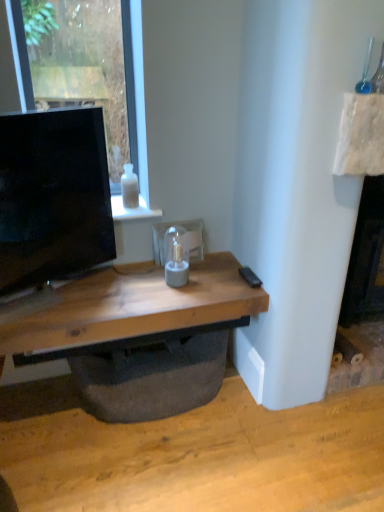
Question: Could you tell me if black plastic remote at lower right is turned towards wooden desk at center?

Choices:
 (A) no
 (B) yes

Answer: (B)

Question: Is black plastic remote at lower right to the left of wooden desk at center from the viewer's perspective?

Choices:
 (A) yes
 (B) no

Answer: (B)

Question: Does black plastic remote at lower right have a smaller size compared to wooden desk at center?

Choices:
 (A) no
 (B) yes

Answer: (B)

Question: From a real-world perspective, is black plastic remote at lower right physically above wooden desk at center?

Choices:
 (A) yes
 (B) no

Answer: (A)

Question: Is wooden desk at center completely or partially inside black plastic remote at lower right?

Choices:
 (A) yes
 (B) no

Answer: (B)

Question: Can you confirm if black plastic remote at lower right is wider than wooden desk at center?

Choices:
 (A) no
 (B) yes

Answer: (A)

Question: From a real-world perspective, is transparent glass window at upper left beneath white glass bottle at upper center?

Choices:
 (A) yes
 (B) no

Answer: (B)

Question: From the image's perspective, is transparent glass window at upper left beneath white glass bottle at upper center?

Choices:
 (A) yes
 (B) no

Answer: (B)

Question: Is transparent glass window at upper left far away from white glass bottle at upper center?

Choices:
 (A) yes
 (B) no

Answer: (B)

Question: Considering the relative positions of transparent glass window at upper left and white glass bottle at upper center in the image provided, is transparent glass window at upper left to the left of white glass bottle at upper center from the viewer's perspective?

Choices:
 (A) yes
 (B) no

Answer: (A)

Question: Considering the relative sizes of transparent glass window at upper left and white glass bottle at upper center in the image provided, is transparent glass window at upper left bigger than white glass bottle at upper center?

Choices:
 (A) no
 (B) yes

Answer: (B)

Question: Is transparent glass window at upper left further to the viewer compared to white glass bottle at upper center?

Choices:
 (A) no
 (B) yes

Answer: (A)

Question: Is matte black tv at left bigger than white glass bottle at upper center?

Choices:
 (A) yes
 (B) no

Answer: (A)